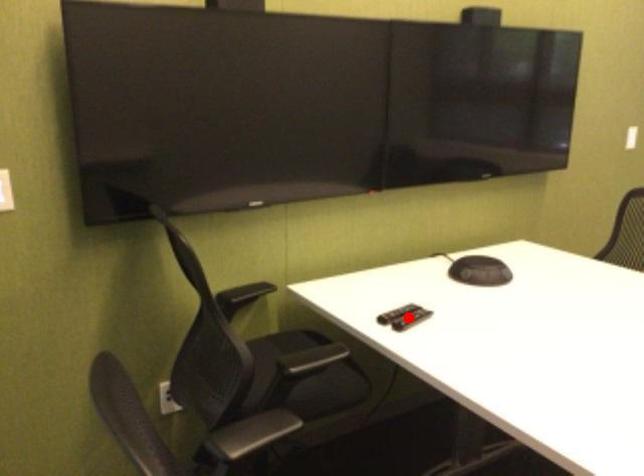
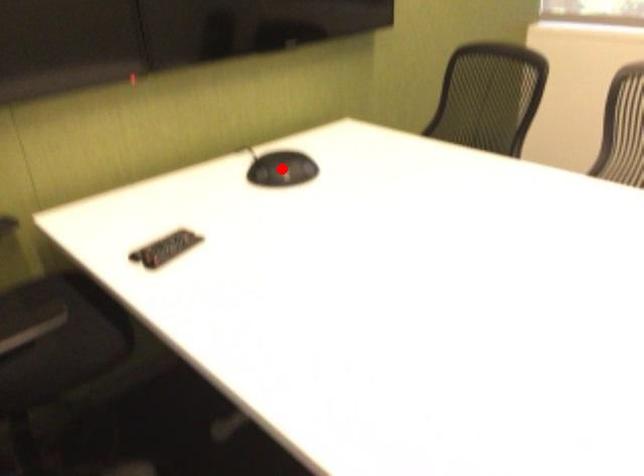
From the picture: I am providing you with two images of the same scene from different viewpoints. A red point is marked on the first image and another point is marked on the second image. Is the marked point in image1 the same physical position as the marked point in image2?

No